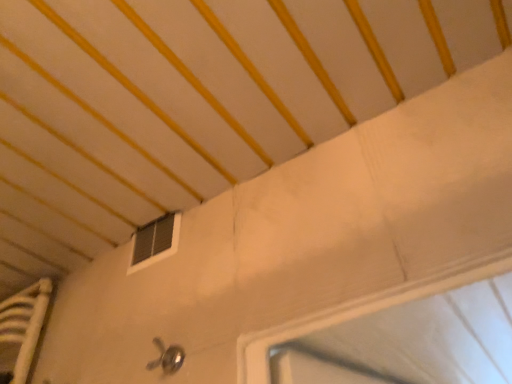
Question: Could polished metallic door handle at lower center be considered to be inside black plastic window at upper center?

Choices:
 (A) no
 (B) yes

Answer: (A)

Question: Could you tell me if black plastic window at upper center is turned towards polished metallic door handle at lower center?

Choices:
 (A) no
 (B) yes

Answer: (A)

Question: Is black plastic window at upper center looking in the opposite direction of polished metallic door handle at lower center?

Choices:
 (A) no
 (B) yes

Answer: (A)

Question: From a real-world perspective, is black plastic window at upper center positioned under polished metallic door handle at lower center based on gravity?

Choices:
 (A) yes
 (B) no

Answer: (B)

Question: Can you confirm if black plastic window at upper center is smaller than polished metallic door handle at lower center?

Choices:
 (A) no
 (B) yes

Answer: (A)

Question: Considering the relative sizes of black plastic window at upper center and polished metallic door handle at lower center in the image provided, is black plastic window at upper center shorter than polished metallic door handle at lower center?

Choices:
 (A) no
 (B) yes

Answer: (A)

Question: Is polished metallic door handle at lower center positioned far away from black plastic window at upper center?

Choices:
 (A) no
 (B) yes

Answer: (A)

Question: Is polished metallic door handle at lower center oriented away from black plastic window at upper center?

Choices:
 (A) yes
 (B) no

Answer: (B)

Question: Is polished metallic door handle at lower center positioned in front of black plastic window at upper center?

Choices:
 (A) yes
 (B) no

Answer: (A)

Question: From a real-world perspective, is polished metallic door handle at lower center below black plastic window at upper center?

Choices:
 (A) no
 (B) yes

Answer: (B)

Question: Are polished metallic door handle at lower center and black plastic window at upper center making contact?

Choices:
 (A) yes
 (B) no

Answer: (B)

Question: From the image's perspective, is polished metallic door handle at lower center above black plastic window at upper center?

Choices:
 (A) yes
 (B) no

Answer: (B)

Question: Considering the positions of polished metallic door handle at lower center and black plastic window at upper center in the image, is polished metallic door handle at lower center taller or shorter than black plastic window at upper center?

Choices:
 (A) short
 (B) tall

Answer: (A)